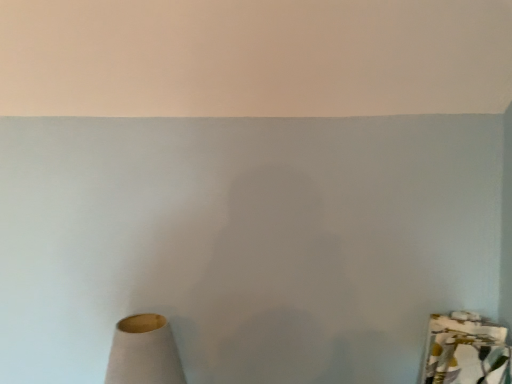
Find the location of `matte beige vase at lower left`. matte beige vase at lower left is located at coordinates (144, 352).

Describe the element at coordinates (144, 352) in the screenshot. I see `matte beige vase at lower left` at that location.

Find the location of `matte beige vase at lower left`. matte beige vase at lower left is located at coordinates (144, 352).